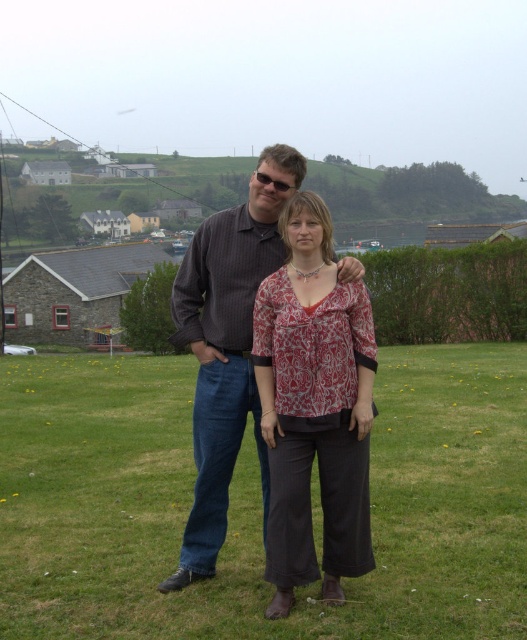
Question: Is green grass at center positioned before patterned fabric blouse at center?

Choices:
 (A) yes
 (B) no

Answer: (A)

Question: Which object is the closest to the dark brown striped shirt at center?

Choices:
 (A) patterned fabric blouse at center
 (B) green grass at center

Answer: (B)

Question: Is patterned fabric blouse at center positioned before dark brown striped shirt at center?

Choices:
 (A) no
 (B) yes

Answer: (B)

Question: Which of the following is the closest to the observer?

Choices:
 (A) patterned fabric blouse at center
 (B) dark brown striped shirt at center
 (C) green grass at center

Answer: (C)

Question: Observing the image, what is the correct spatial positioning of patterned fabric blouse at center in reference to dark brown striped shirt at center?

Choices:
 (A) left
 (B) right

Answer: (B)

Question: Which of these objects is positioned closest to the dark brown striped shirt at center?

Choices:
 (A) green grass at center
 (B) patterned fabric blouse at center

Answer: (A)